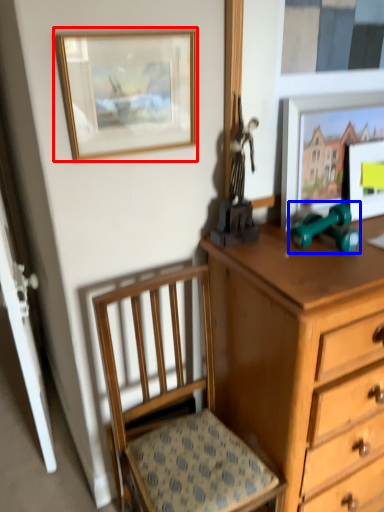
Question: Which object appears farthest to the camera in this image, picture frame (highlighted by a red box) or toy (highlighted by a blue box)?

Choices:
 (A) picture frame
 (B) toy

Answer: (B)